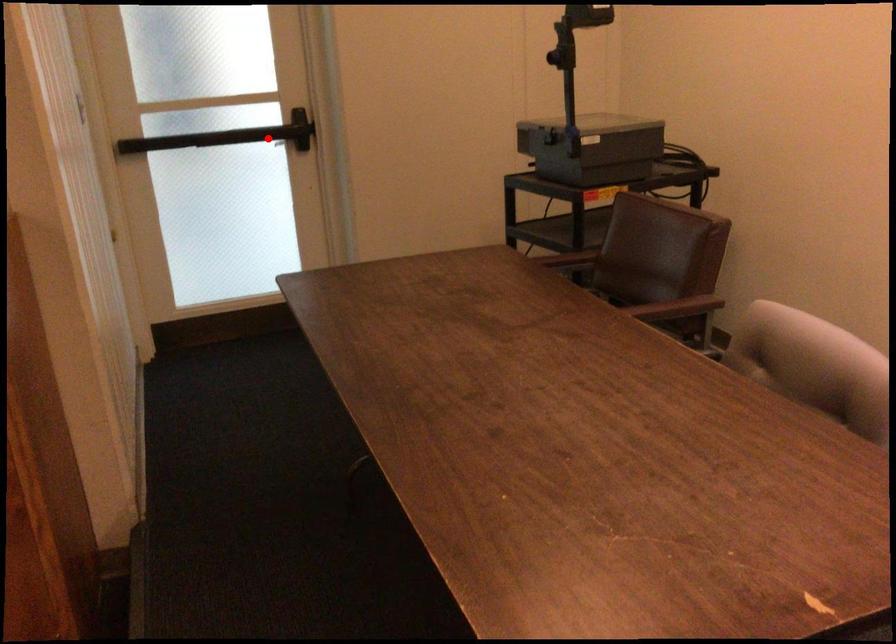
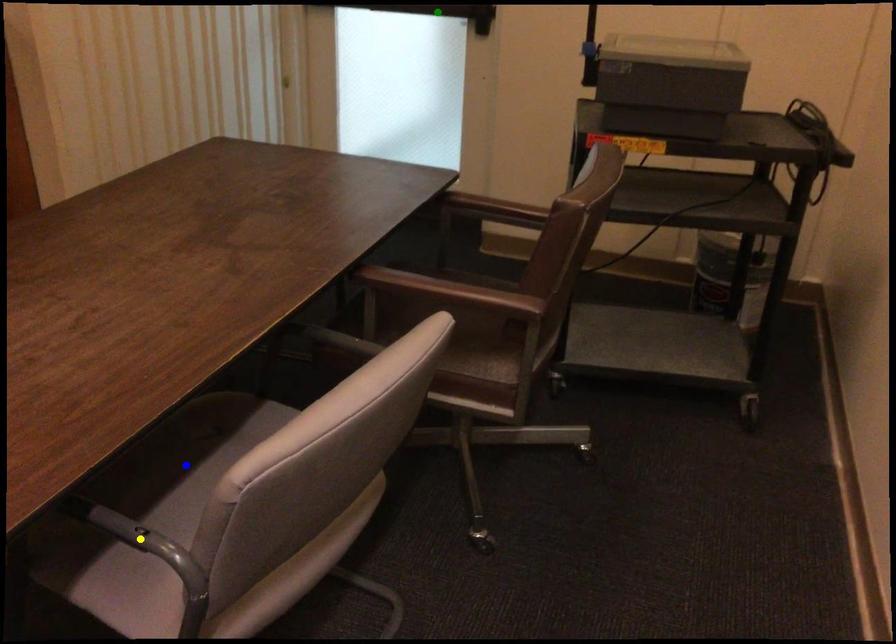
Question: I am providing you with two images of the same scene from different viewpoints. A red point is marked on the first image. You are given multiple points on the second image. In image 2, which mark is for the same physical point as the one in image 1?

Choices:
 (A) blue point
 (B) yellow point
 (C) green point

Answer: (C)